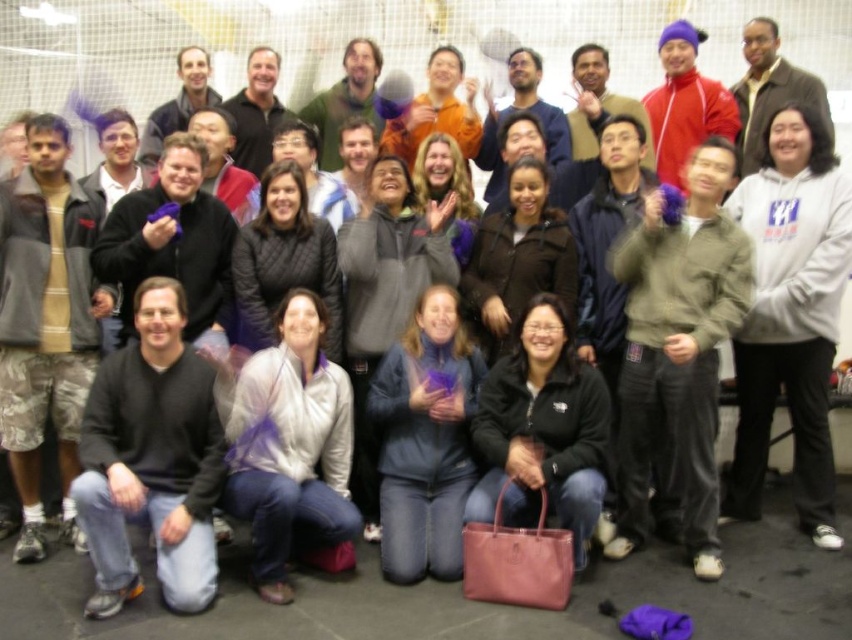
You are organizing a photo shoot and need to arrange the white fleece hoodie at right and the black matte jacket at lower center in a vertical line. Which one should be placed higher to ensure they are aligned properly based on their actual sizes?

The white fleece hoodie at right is taller than the black matte jacket at lower center, so it should be placed higher in the vertical line to maintain proper alignment based on their sizes.

You are organizing a group photo and need to position the matte gray jacket at center and the black matte jacket at lower center correctly. According to the scene, which jacket should be placed to the right side of the other?

The matte gray jacket at center should be placed to the right of the black matte jacket at lower center as per the description.